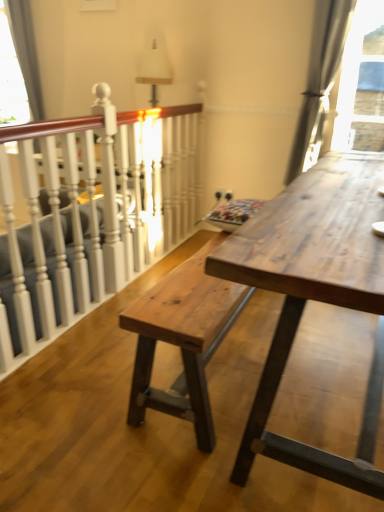
Question: Is point (36, 55) closer or farther from the camera than point (336, 19)?

Choices:
 (A) closer
 (B) farther

Answer: (B)

Question: In the image, is transparent glass window at upper left positioned in front of or behind satin gray curtain at upper right?

Choices:
 (A) front
 (B) behind

Answer: (B)

Question: Based on their relative distances, which object is farther from the satin gray curtain at upper right?

Choices:
 (A) white painted wood at left
 (B) natural wood table at center
 (C) natural wood bench at center
 (D) transparent glass window at upper left

Answer: (D)

Question: Considering the real-world distances, which object is closest to the natural wood table at center?

Choices:
 (A) transparent glass window at upper left
 (B) satin gray curtain at upper right
 (C) natural wood bench at center
 (D) white painted wood at left

Answer: (C)